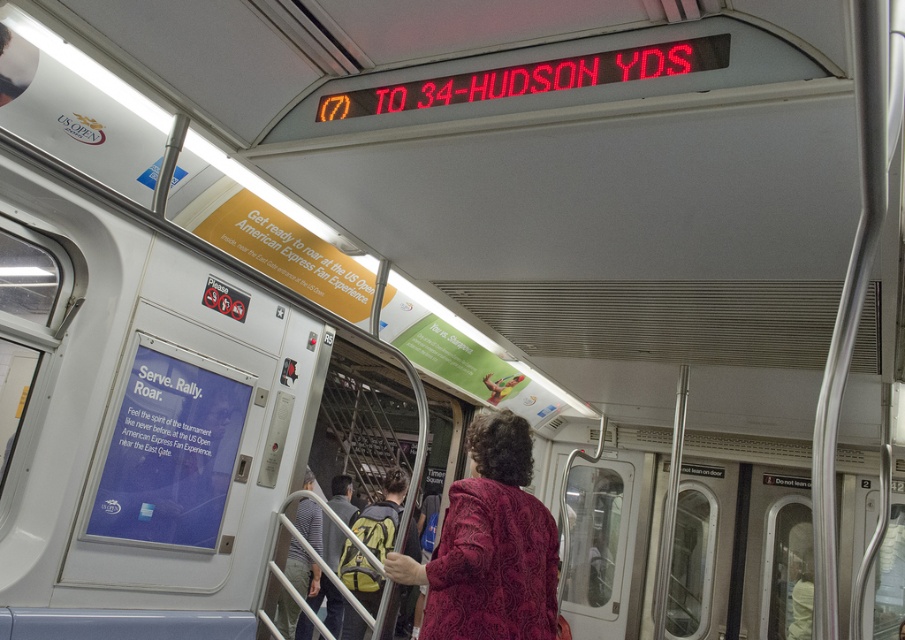
You are standing in the subway car and need to place a new advertisement poster. The poster requires a wall space that is not occupied by any existing objects. Considering the velvet burgundy coat at center, where would be a suitable location to place the new poster?

The velvet burgundy coat at center is located at point (491, 545). A suitable location for the new poster would be a wall space that does not overlap with this coordinate, such as areas away from the center where the coat is placed.